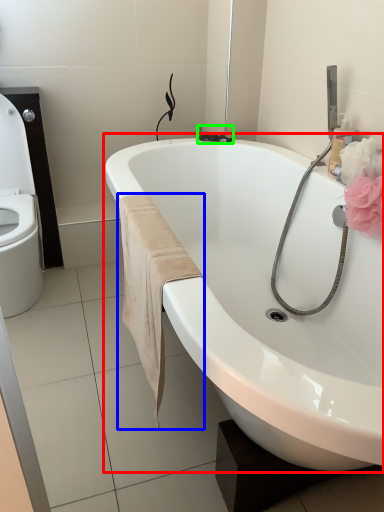
Question: Which is nearer to the bathtub (highlighted by a red box)? bath towel (highlighted by a blue box) or plumbing fixture (highlighted by a green box).

Choices:
 (A) bath towel
 (B) plumbing fixture

Answer: (A)